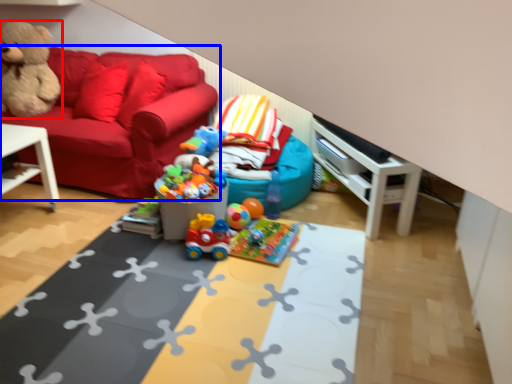
Question: Which point is closer to the camera, teddy bear (highlighted by a red box) or studio couch (highlighted by a blue box)?

Choices:
 (A) teddy bear
 (B) studio couch

Answer: (B)